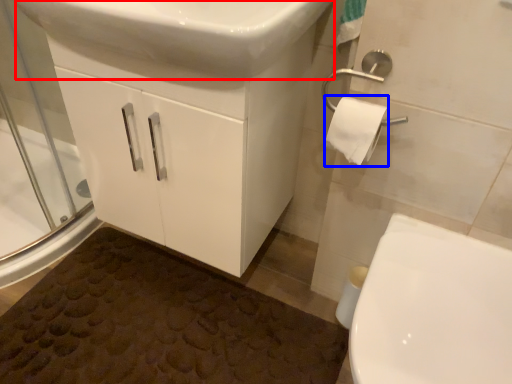
Question: Which of the following is the closest to the observer, sink (highlighted by a red box) or toilet paper (highlighted by a blue box)?

Choices:
 (A) sink
 (B) toilet paper

Answer: (A)